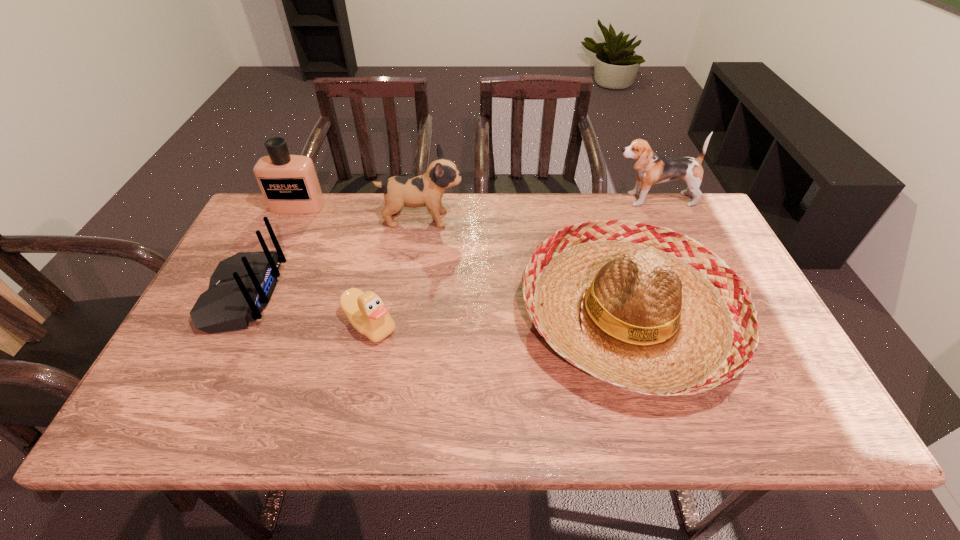
Image resolution: width=960 pixels, height=540 pixels. Identify the location of the right puppy. (652, 168).

At what (x,y) coordinates should I click in order to perform the action: click on the left puppy. Please return your answer as a coordinate pair (x, y). The width and height of the screenshot is (960, 540). Looking at the image, I should click on (427, 190).

Locate an element on the screen. perfume is located at coordinates (289, 183).

The image size is (960, 540). Identify the location of sombrero. (644, 308).

This screenshot has width=960, height=540. Identify the location of the fifth tallest object. (242, 285).

Find the location of a particular element. The width and height of the screenshot is (960, 540). duck is located at coordinates (366, 311).

Where is `free location located 0.250m at the face of the farther puppy`? free location located 0.250m at the face of the farther puppy is located at coordinates (534, 200).

Where is `vacant area situated at the face of the farther puppy`? The image size is (960, 540). vacant area situated at the face of the farther puppy is located at coordinates (518, 200).

Where is `free space located at the face of the farther puppy`? The height and width of the screenshot is (540, 960). free space located at the face of the farther puppy is located at coordinates (524, 200).

Identify the location of vacant space located at the face of the left puppy. This screenshot has height=540, width=960. (492, 219).